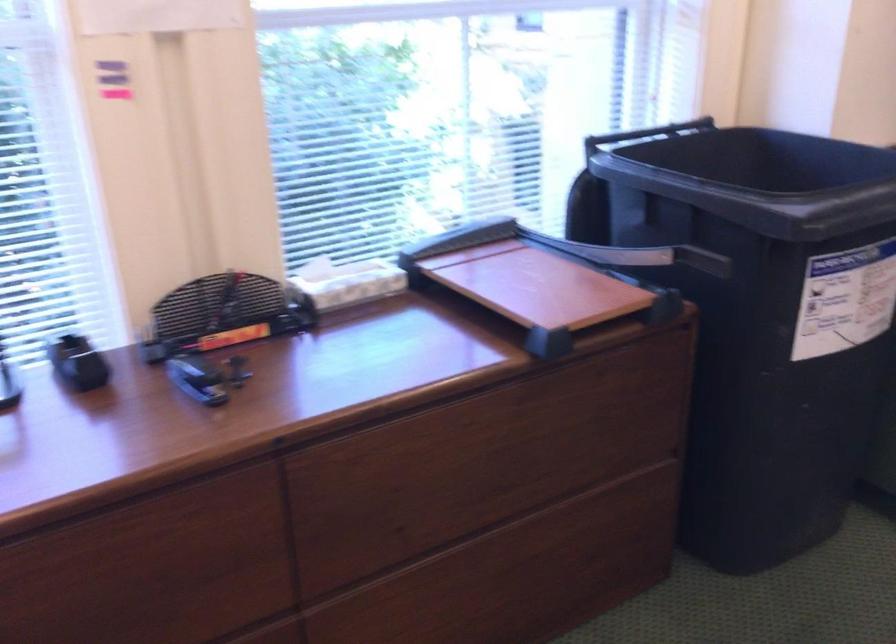
Question: The camera is either moving clockwise (left) or counter-clockwise (right) around the object. The first image is from the beginning of the video and the second image is from the end. Is the camera moving left or right when shooting the video?

Choices:
 (A) Left
 (B) Right

Answer: (A)